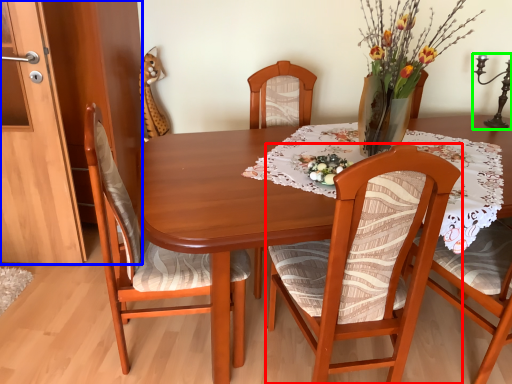
Question: Considering the real-world distances, which object is farthest from chair (highlighted by a red box)? cabinetry (highlighted by a blue box) or candle holder (highlighted by a green box)?

Choices:
 (A) cabinetry
 (B) candle holder

Answer: (B)